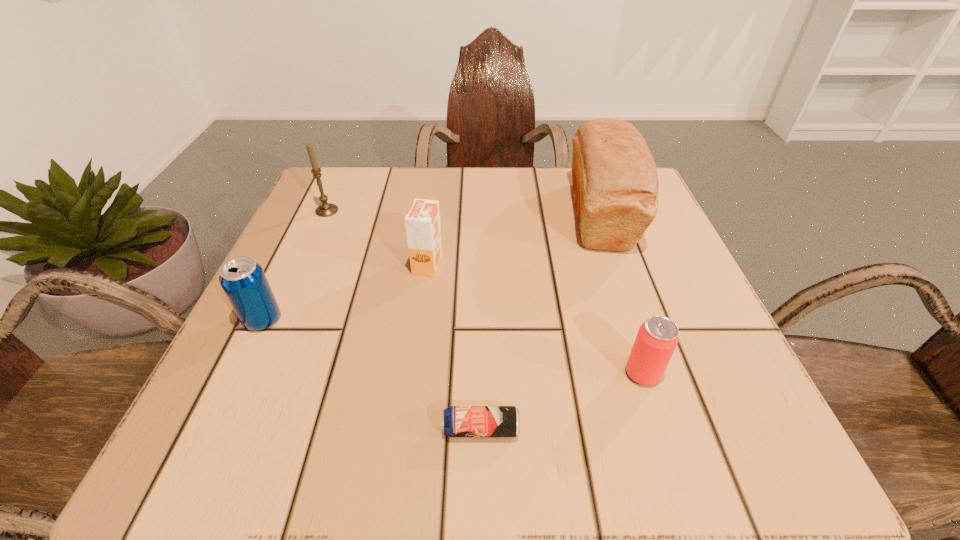
At what (x,y) coordinates should I click in order to perform the action: click on vacant area between the bread and the candle. Please return your answer as a coordinate pair (x, y). This screenshot has height=540, width=960. Looking at the image, I should click on (464, 213).

Identify the location of free space between the fourth object from left to right and the fourth farthest object. (372, 374).

Locate an element on the screen. This screenshot has width=960, height=540. free space that is in between the candle and the taller beer can is located at coordinates 485,292.

This screenshot has width=960, height=540. I want to click on unoccupied position between the orange juice and the bread, so click(x=514, y=240).

The height and width of the screenshot is (540, 960). What are the coordinates of `empty location between the fourth object from right to left and the bread` in the screenshot? It's located at (514, 240).

Identify the location of free space between the left beer can and the orange juice. (454, 347).

You are a GUI agent. You are given a task and a screenshot of the screen. Output one action in this format:
    pyautogui.click(x=<x>, y=<y>)
    Task: Click on the vacant space in between the bread and the nearer beer can
    
    Given the screenshot: What is the action you would take?
    540,322

Identify the location of vacant area that lies between the pop soda and the candle. (295, 265).

At what (x,y) coordinates should I click in order to perform the action: click on blank region between the third object from left to right and the candle. Please return your answer as a coordinate pair (x, y). This screenshot has height=540, width=960. Looking at the image, I should click on (377, 238).

Locate which object is the third closest to the pop soda. Please provide its 2D coordinates. Your answer should be formatted as a tuple, i.e. [(x, y)], where the tuple contains the x and y coordinates of a point satisfying the conditions above.

[(458, 421)]